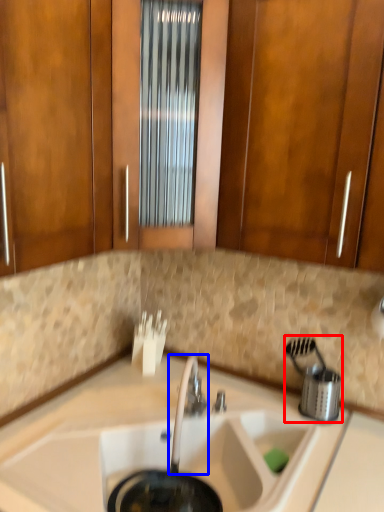
Question: Among these objects, which one is nearest to the camera, appliance (highlighted by a red box) or tap (highlighted by a blue box)?

Choices:
 (A) appliance
 (B) tap

Answer: (B)